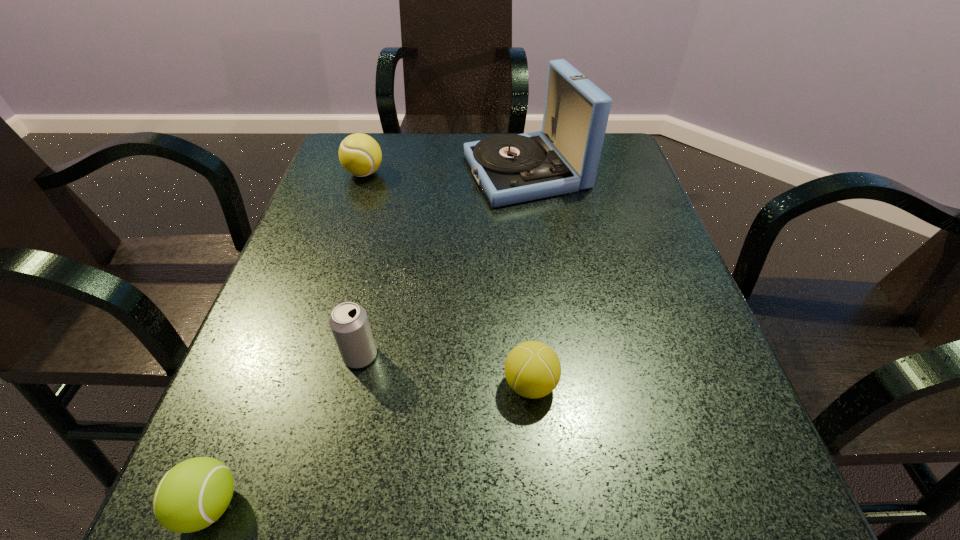
Where is `beer can that is at the left edge`? This screenshot has width=960, height=540. beer can that is at the left edge is located at coordinates (349, 323).

Locate an element on the screen. Image resolution: width=960 pixels, height=540 pixels. tennis ball present at the left edge is located at coordinates (360, 155).

Locate an element on the screen. Image resolution: width=960 pixels, height=540 pixels. object present at the right edge is located at coordinates (563, 158).

The image size is (960, 540). I want to click on object located in the far left corner section of the desktop, so click(x=360, y=155).

The image size is (960, 540). In order to click on object that is at the far right corner in this screenshot , I will do tap(563, 158).

The height and width of the screenshot is (540, 960). In order to click on free region at the far edge in this screenshot , I will do `click(457, 148)`.

Where is `blank area at the near edge`? blank area at the near edge is located at coordinates (588, 514).

This screenshot has height=540, width=960. Identify the location of vacant space at the left edge of the desktop. (274, 459).

In the image, there is a desktop. Where is `free space at the right edge`? This screenshot has width=960, height=540. free space at the right edge is located at coordinates (658, 395).

Image resolution: width=960 pixels, height=540 pixels. What are the coordinates of `vacant space at the far left corner of the desktop` in the screenshot? It's located at (386, 158).